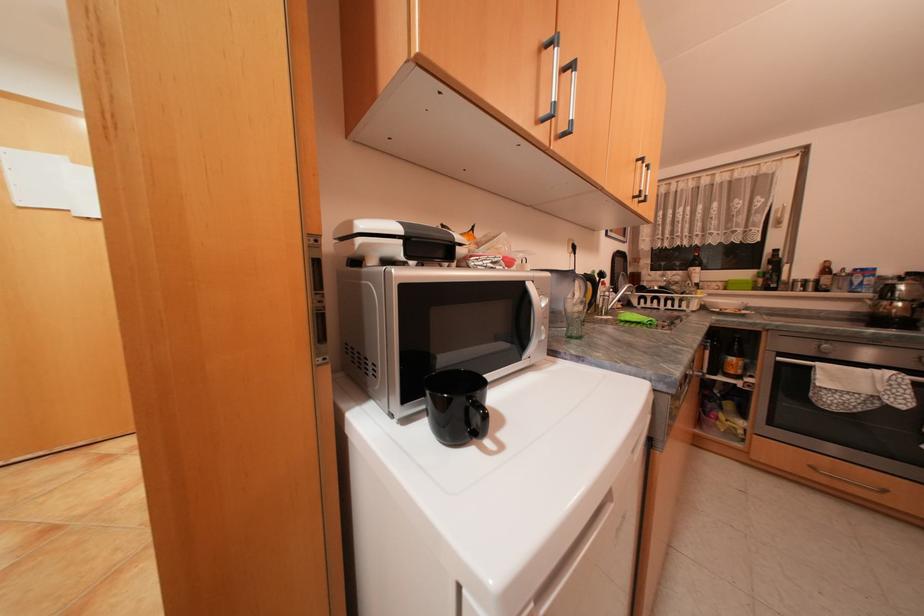
The image size is (924, 616). I want to click on clear drinking glass, so click(x=575, y=315).